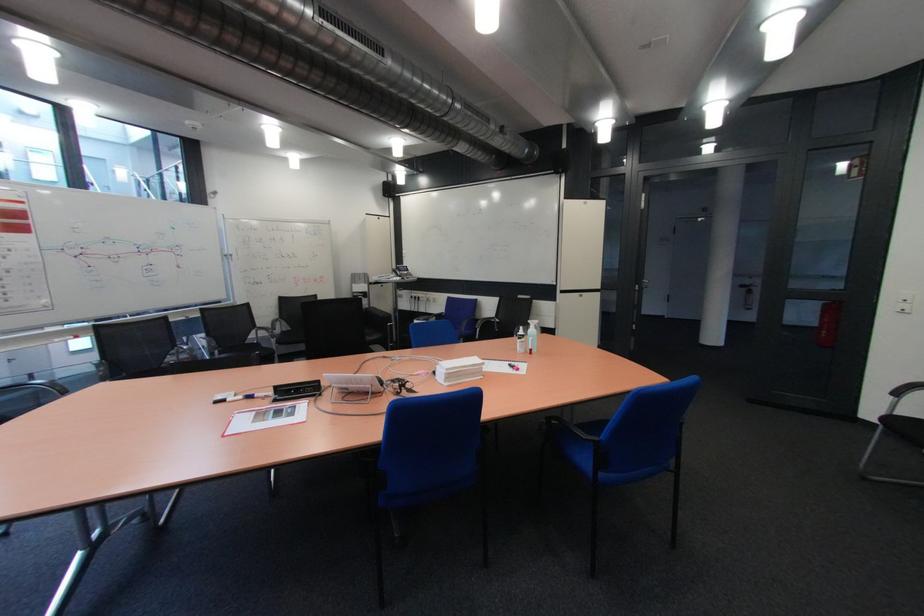
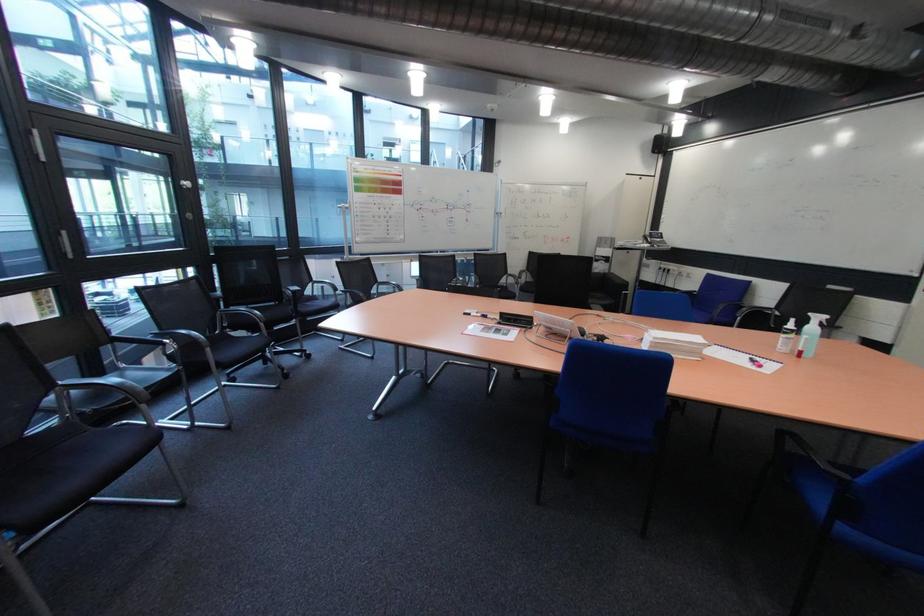
Question: The camera is either moving clockwise (left) or counter-clockwise (right) around the object. The first image is from the beginning of the video and the second image is from the end. Is the camera moving left or right when shooting the video?

Choices:
 (A) Left
 (B) Right

Answer: (B)